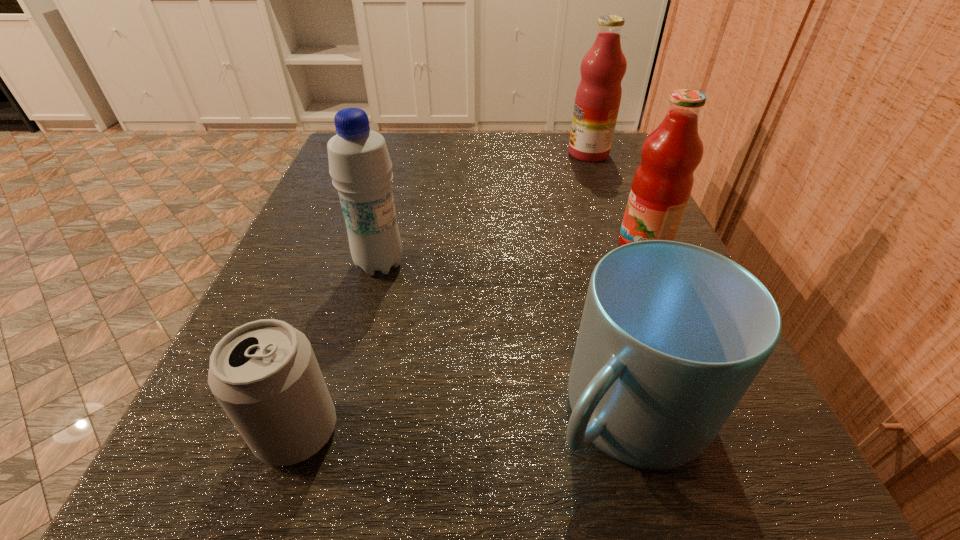
Image resolution: width=960 pixels, height=540 pixels. I want to click on object at the near left corner, so pos(264,374).

Locate an element on the screen. This screenshot has height=540, width=960. object located at the far right corner is located at coordinates (598, 96).

The height and width of the screenshot is (540, 960). I want to click on object present at the near right corner, so click(672, 335).

You are a GUI agent. You are given a task and a screenshot of the screen. Output one action in this format:
    pyautogui.click(x=<x>, y=<y>)
    Task: Click on the vacant space at the far edge of the desktop
    This screenshot has height=540, width=960.
    Given the screenshot: What is the action you would take?
    pyautogui.click(x=526, y=158)

You are a GUI agent. You are given a task and a screenshot of the screen. Output one action in this format:
    pyautogui.click(x=<x>, y=<y>)
    Task: Click on the vacant region at the left edge of the desktop
    The image size is (960, 540).
    Given the screenshot: What is the action you would take?
    pyautogui.click(x=203, y=405)

In the image, there is a desktop. Identify the location of vacant space at the right edge. (561, 189).

The image size is (960, 540). Find the location of `blank space at the far right corner of the desktop`. blank space at the far right corner of the desktop is located at coordinates (607, 173).

Where is `vacant space at the near right corner of the desktop`? The width and height of the screenshot is (960, 540). vacant space at the near right corner of the desktop is located at coordinates (740, 484).

At what (x,y) coordinates should I click in order to perform the action: click on vacant area between the farther fruit juice and the can. Please return your answer as a coordinate pair (x, y). This screenshot has height=540, width=960. Looking at the image, I should click on (443, 292).

Identify the location of vacant region between the farther fruit juice and the water bottle. (484, 209).